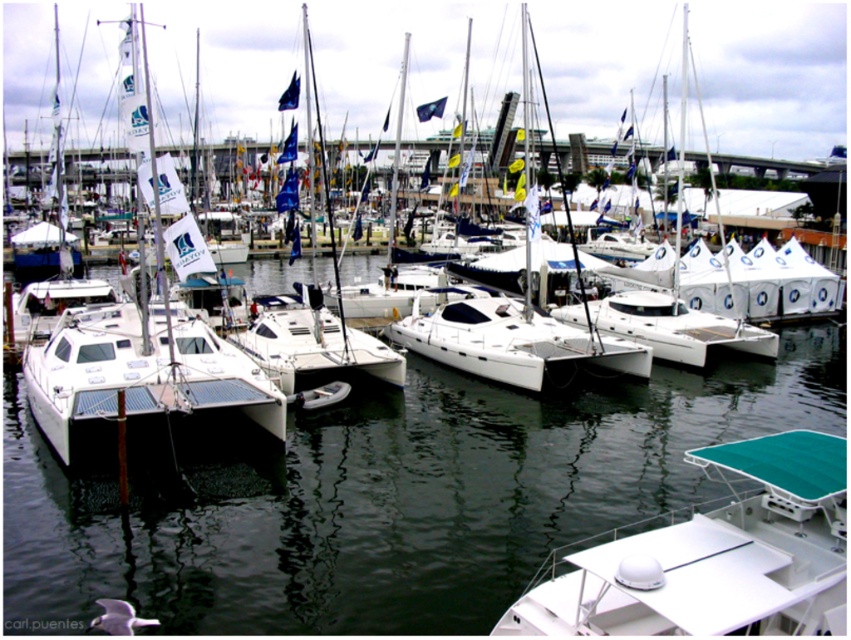
Between white glossy water at center and white matte catamaran at center, which one has less height?

Standing shorter between the two is white matte catamaran at center.

Can you confirm if white glossy water at center is smaller than white matte catamaran at center?

Incorrect, white glossy water at center is not smaller in size than white matte catamaran at center.

Where is `white glossy water at center`? white glossy water at center is located at coordinates (390, 499).

Where is `white glossy water at center`? The image size is (851, 640). white glossy water at center is located at coordinates (390, 499).

Which is more to the right, white glossy water at center or white plastic boat at lower right?

From the viewer's perspective, white glossy water at center appears more on the right side.

Does white glossy water at center have a larger size compared to white plastic boat at lower right?

Correct, white glossy water at center is larger in size than white plastic boat at lower right.

Is point (366, 557) positioned after point (798, 627)?

Yes.

At what (x,y) coordinates should I click in order to perform the action: click on white glossy water at center. Please return your answer as a coordinate pair (x, y). This screenshot has height=640, width=851. Looking at the image, I should click on (390, 499).

Does white plastic boat at lower right have a greater height compared to white matte catamaran at center?

No.

Which of these two, white plastic boat at lower right or white matte catamaran at center, stands shorter?

Standing shorter between the two is white plastic boat at lower right.

What do you see at coordinates (711, 554) in the screenshot? I see `white plastic boat at lower right` at bounding box center [711, 554].

Identify the location of white plastic boat at lower right. The height and width of the screenshot is (640, 851). (711, 554).